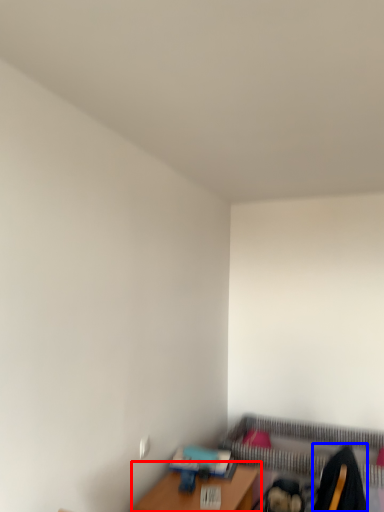
Question: Which point is further to the camera, table (highlighted by a red box) or swivel chair (highlighted by a blue box)?

Choices:
 (A) table
 (B) swivel chair

Answer: (A)